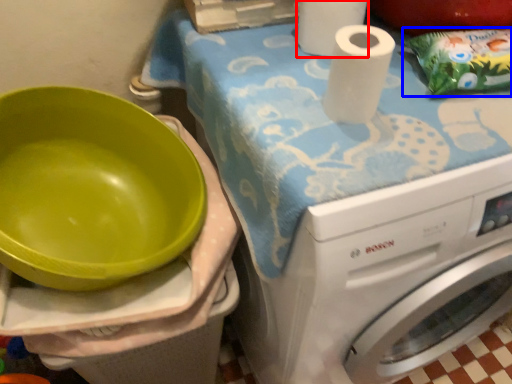
Question: Which point is further to the camera, paper towel (highlighted by a red box) or waste (highlighted by a blue box)?

Choices:
 (A) paper towel
 (B) waste

Answer: (A)